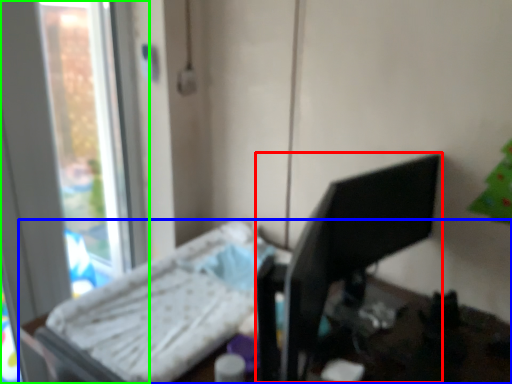
Question: Estimate the real-world distances between objects in this image. Which object is farther from desktop computer (highlighted by a red box), furniture (highlighted by a blue box) or window (highlighted by a green box)?

Choices:
 (A) furniture
 (B) window

Answer: (B)